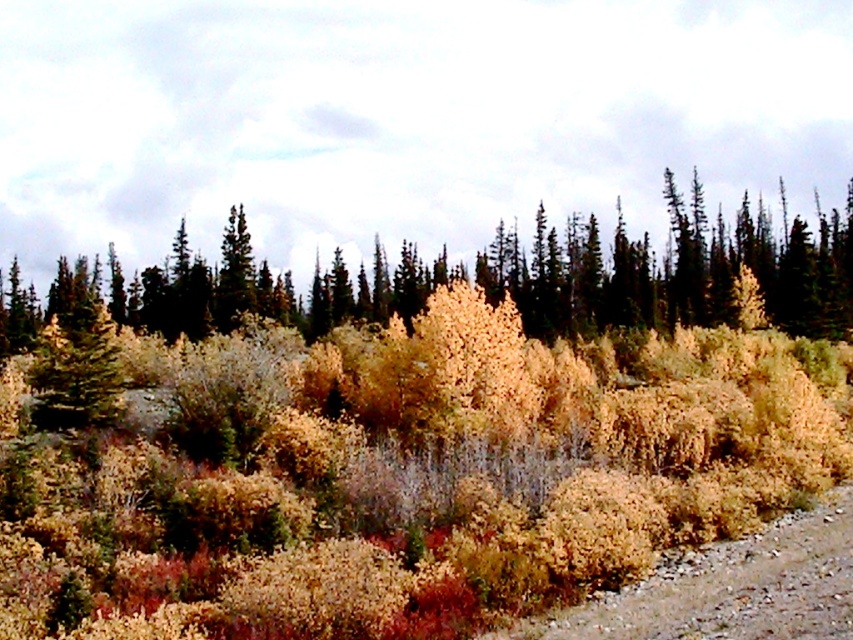
Question: Is golden dry shrubs at center further to the viewer compared to brown gravel at lower right?

Choices:
 (A) no
 (B) yes

Answer: (B)

Question: Estimate the real-world distances between objects in this image. Which object is farther from the brown gravel at lower right?

Choices:
 (A) golden dry shrubs at center
 (B) golden textured shrub at center

Answer: (B)

Question: Which object appears farthest from the camera in this image?

Choices:
 (A) golden dry shrubs at center
 (B) golden textured shrub at center
 (C) brown gravel at lower right

Answer: (B)

Question: Which of the following is the farthest from the observer?

Choices:
 (A) golden textured shrub at center
 (B) golden dry shrubs at center

Answer: (A)

Question: Is golden dry shrubs at center closer to camera compared to golden textured shrub at center?

Choices:
 (A) yes
 (B) no

Answer: (A)

Question: Is golden dry shrubs at center thinner than brown gravel at lower right?

Choices:
 (A) no
 (B) yes

Answer: (A)